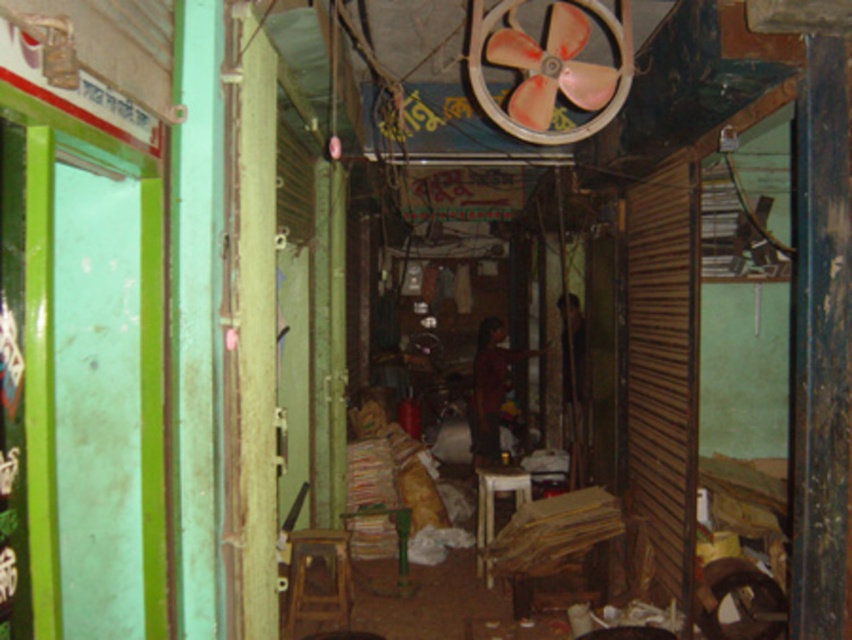
Which of these two, pink plastic fan at upper center or wooden stool at center, stands taller?

pink plastic fan at upper center is taller.

Measure the distance between pink plastic fan at upper center and camera.

pink plastic fan at upper center is 10.34 feet away from camera.

Find the location of a particular element. Image resolution: width=852 pixels, height=640 pixels. pink plastic fan at upper center is located at coordinates (550, 67).